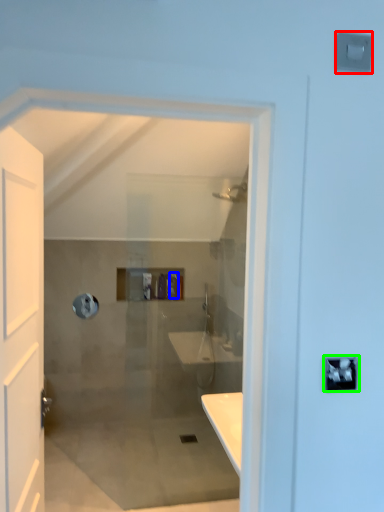
Question: Based on their relative distances, which object is farther from light switch (highlighted by a red box)? Choose from toiletry (highlighted by a blue box) and lock (highlighted by a green box).

Choices:
 (A) toiletry
 (B) lock

Answer: (A)